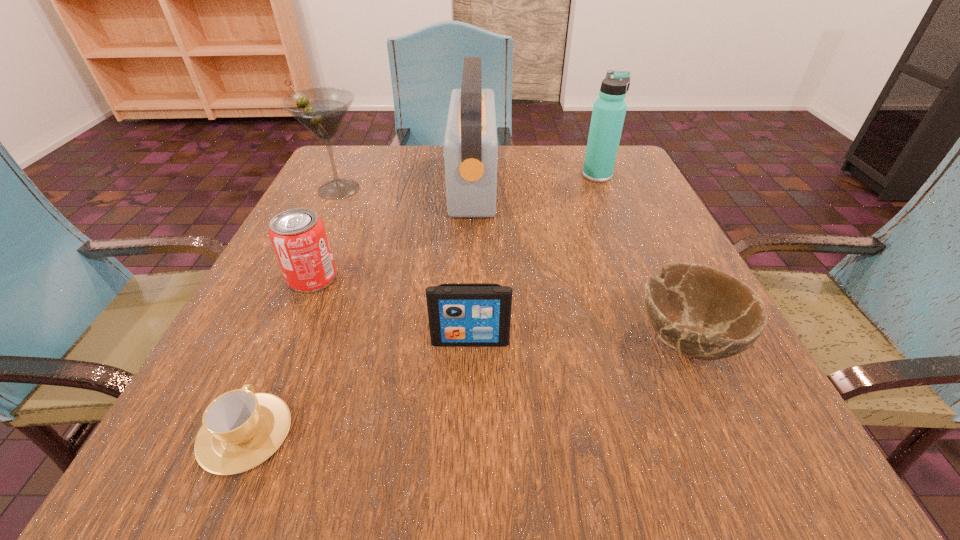
This screenshot has width=960, height=540. I want to click on vacant space at the near edge of the desktop, so click(x=632, y=421).

At what (x,y) coordinates should I click in order to perform the action: click on vacant space at the left edge of the desktop. Please return your answer as a coordinate pair (x, y). The image size is (960, 540). Looking at the image, I should click on (259, 358).

Image resolution: width=960 pixels, height=540 pixels. I want to click on vacant space at the right edge of the desktop, so click(598, 225).

I want to click on vacant space at the far left corner, so click(x=374, y=168).

Where is `blank space at the far right corner`? Image resolution: width=960 pixels, height=540 pixels. blank space at the far right corner is located at coordinates (616, 168).

I want to click on vacant space at the near right corner of the desktop, so click(721, 470).

The height and width of the screenshot is (540, 960). I want to click on free spot between the can and the nearest object, so click(x=278, y=355).

What are the coordinates of `free space between the cup and the second shortest object` in the screenshot? It's located at (466, 386).

Locate an element on the screen. Image resolution: width=960 pixels, height=540 pixels. blank region between the martini and the bowl is located at coordinates (513, 264).

Image resolution: width=960 pixels, height=540 pixels. I want to click on vacant point located between the radio receiver and the nearest object, so click(x=359, y=308).